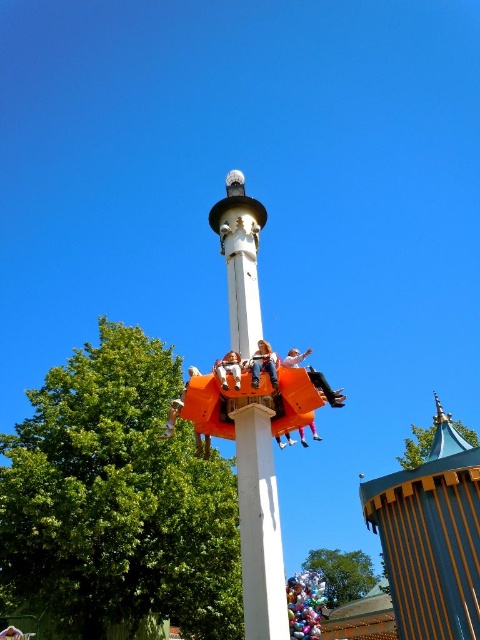
Does orange plastic person at center have a smaller size compared to orange plastic seat at center?

No, orange plastic person at center is not smaller than orange plastic seat at center.

Can you confirm if orange plastic person at center is wider than orange plastic seat at center?

Indeed, orange plastic person at center has a greater width compared to orange plastic seat at center.

Is point (276, 358) behind point (237, 360)?

Yes, point (276, 358) is behind point (237, 360).

You are a GUI agent. You are given a task and a screenshot of the screen. Output one action in this format:
    pyautogui.click(x=<x>, y=<y>)
    Task: Click on the orange plastic person at center
    This screenshot has width=480, height=640.
    Given the screenshot: What is the action you would take?
    pyautogui.click(x=264, y=364)

From the picture: Which of these two, orange plastic amusement park ride at center or wooden striped tower at center, stands taller?

With more height is orange plastic amusement park ride at center.

Is point (433, 576) less distant than point (405, 536)?

Yes, point (433, 576) is in front of point (405, 536).

Identify the location of orange plastic amusement park ride at center. click(x=431, y=538).

Which of these two, orange plastic amusement park ride at center or matte orange slide at center, stands shorter?

Standing shorter between the two is matte orange slide at center.

What do you see at coordinates (431, 538) in the screenshot? This screenshot has height=640, width=480. I see `orange plastic amusement park ride at center` at bounding box center [431, 538].

I want to click on orange plastic amusement park ride at center, so 431,538.